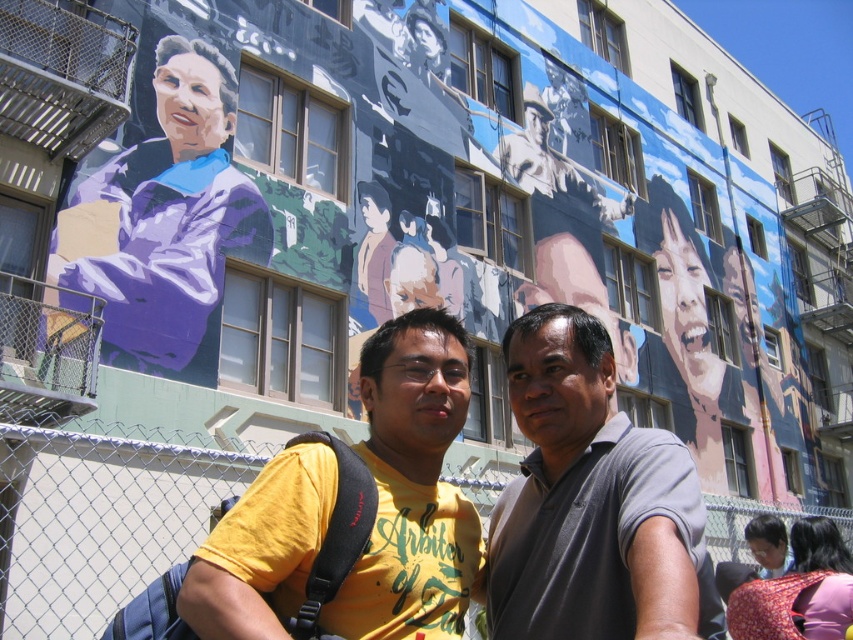
Between gray matte shirt at center and red floral dress at lower right, which one is positioned higher?

gray matte shirt at center

Can you confirm if gray matte shirt at center is wider than red floral dress at lower right?

No.

Measure the distance between point (598, 353) and camera.

Point (598, 353) and camera are 56.93 feet apart from each other.

In order to click on gray matte shirt at center in this screenshot , I will do (x=590, y=500).

What do you see at coordinates (590, 500) in the screenshot? I see `gray matte shirt at center` at bounding box center [590, 500].

Is point (689, 564) more distant than point (467, 364)?

No, it is not.

Does point (688, 557) come closer to viewer compared to point (477, 532)?

Yes, point (688, 557) is closer to viewer.

At what (x,y) coordinates should I click in order to perform the action: click on gray matte shirt at center. Please return your answer as a coordinate pair (x, y). Image resolution: width=853 pixels, height=640 pixels. Looking at the image, I should click on (590, 500).

Describe the element at coordinates (103, 522) in the screenshot. I see `white chain-link fence at lower left` at that location.

From the picture: Can you confirm if white chain-link fence at lower left is thinner than red floral dress at lower right?

Incorrect, white chain-link fence at lower left's width is not less than red floral dress at lower right's.

Locate an element on the screen. Image resolution: width=853 pixels, height=640 pixels. white chain-link fence at lower left is located at coordinates (103, 522).

Locate an element on the screen. Image resolution: width=853 pixels, height=640 pixels. white chain-link fence at lower left is located at coordinates (103, 522).